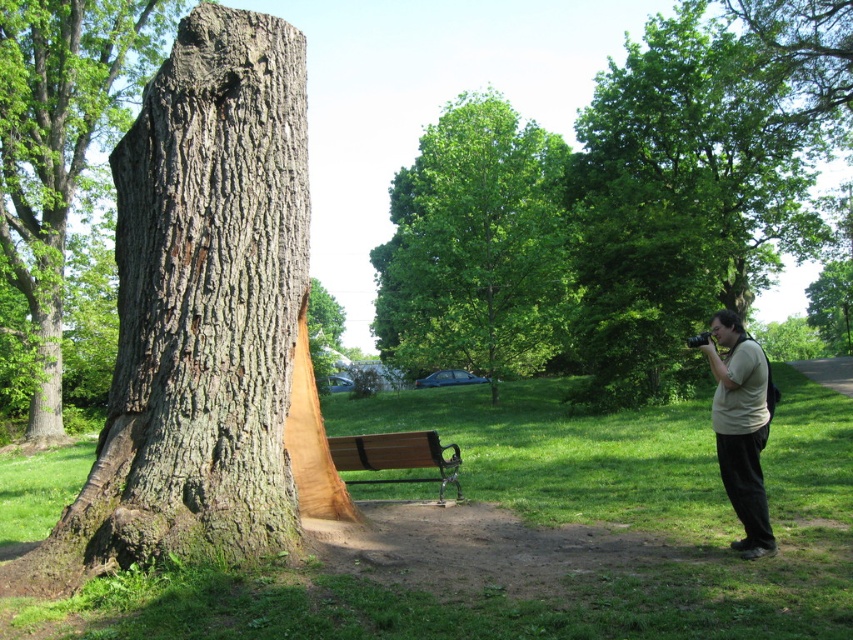
Question: Which object is positioned farthest from the green rough bark tree at center?

Choices:
 (A) green leafy tree at right
 (B) green leafy tree at center
 (C) light beige shirt at right

Answer: (C)

Question: Can you confirm if light beige shirt at right is smaller than brown wooden bench at center?

Choices:
 (A) no
 (B) yes

Answer: (B)

Question: Is smooth brown bark at center positioned before brown wooden bench at center?

Choices:
 (A) no
 (B) yes

Answer: (A)

Question: Is smooth brown bark at center further to camera compared to light beige shirt at right?

Choices:
 (A) yes
 (B) no

Answer: (A)

Question: Which point is farther to the camera?

Choices:
 (A) (216, 48)
 (B) (113, 22)
 (C) (728, 461)
 (D) (838, 284)

Answer: (D)

Question: Estimate the real-world distances between objects in this image. Which object is closer to the green leafy tree at right?

Choices:
 (A) smooth bark tree trunk at center
 (B) light beige shirt at right

Answer: (A)